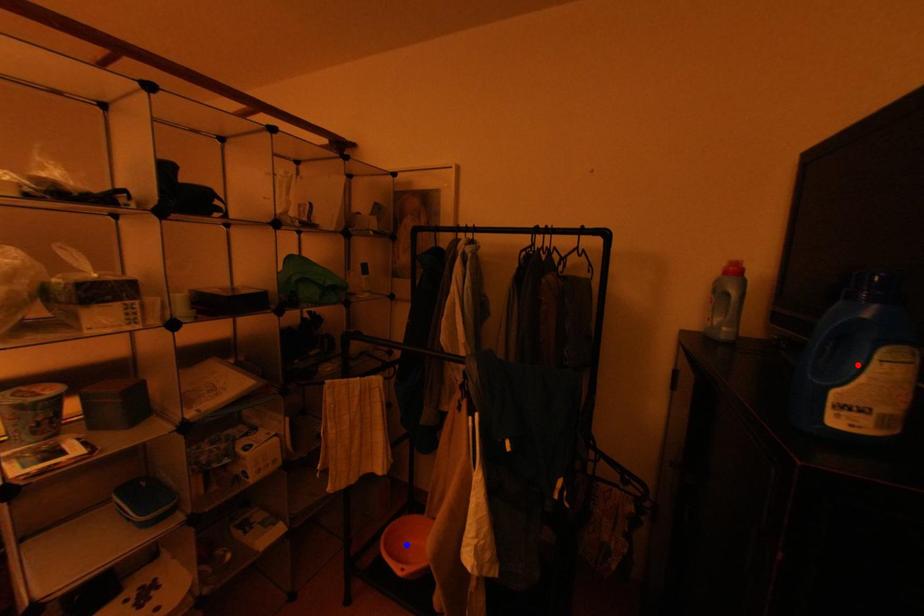
Question: Which of the two points in the image is closer to the camera?

Choices:
 (A) Blue point is closer.
 (B) Red point is closer.

Answer: (B)